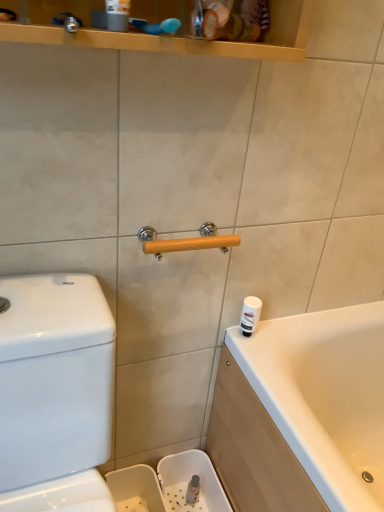
Describe the element at coordinates (54, 384) in the screenshot. The height and width of the screenshot is (512, 384). I see `white glossy water tank at left` at that location.

At what (x,y) coordinates should I click in order to perform the action: click on wooden at center. Please return your answer as a coordinate pair (x, y). The image size is (384, 512). Looking at the image, I should click on (187, 241).

From a real-world perspective, is white plastic container at right physically above white glossy water tank at left?

Yes, from a real-world perspective, white plastic container at right is over white glossy water tank at left

Is white plastic container at right bigger than white glossy water tank at left?

Actually, white plastic container at right might be smaller than white glossy water tank at left.

Considering the relative sizes of white plastic container at right and white glossy water tank at left in the image provided, is white plastic container at right taller than white glossy water tank at left?

Incorrect, the height of white plastic container at right is not larger of that of white glossy water tank at left.

From the picture: Does wooden at center have a greater height compared to white plastic container at right?

No.

Considering the relative positions of wooden at center and white plastic container at right in the image provided, is wooden at center behind white plastic container at right?

No, it is in front of white plastic container at right.

Between wooden at center and white glossy water tank at left, which one has smaller width?

wooden at center.

Considering the sizes of objects wooden at center and white glossy water tank at left in the image provided, who is taller, wooden at center or white glossy water tank at left?

white glossy water tank at left.

The image size is (384, 512). Identify the location of water tank below the wooden at center (from the image's perspective). (54, 384).

Is wooden at center to the left of white glossy water tank at left from the viewer's perspective?

No, wooden at center is not to the left of white glossy water tank at left.

From the image's perspective, does white glossy water tank at left appear lower than wooden at center?

Correct, white glossy water tank at left appears lower than wooden at center in the image.

Can you see white glossy water tank at left touching wooden at center?

No, white glossy water tank at left is not in contact with wooden at center.

This screenshot has height=512, width=384. In the image, there is a wooden at center. In order to click on water tank below it (from a real-world perspective) in this screenshot , I will do pos(54,384).

Considering the relative sizes of white glossy water tank at left and wooden at center in the image provided, is white glossy water tank at left bigger than wooden at center?

Correct, white glossy water tank at left is larger in size than wooden at center.

In the scene shown: Measure the distance between white glossy water tank at left and white plastic container at right.

18.41 inches.

Identify the location of water tank located underneath the white plastic container at right (from a real-world perspective). (54, 384).

Considering the sizes of objects white glossy water tank at left and white plastic container at right in the image provided, who is shorter, white glossy water tank at left or white plastic container at right?

Standing shorter between the two is white plastic container at right.

Consider the image. Which is in front, white plastic container at right or wooden at center?

wooden at center is closer to the camera.

Is white plastic container at right turned away from wooden at center?

No, white plastic container at right is not facing the opposite direction of wooden at center.

This screenshot has height=512, width=384. Find the location of `door handle that appears on the left of white plastic container at right`. door handle that appears on the left of white plastic container at right is located at coordinates (187, 241).

From a real-world perspective, is white plastic container at right positioned above or below wooden at center?

white plastic container at right is situated lower than wooden at center in the real world.

Where is `water tank in front of the white plastic container at right`? The image size is (384, 512). water tank in front of the white plastic container at right is located at coordinates (54, 384).

Identify the location of door handle that is above the white plastic container at right (from a real-world perspective). This screenshot has width=384, height=512. (187, 241).

Consider the image. Based on their spatial positions, is white glossy water tank at left or white plastic container at right closer to wooden at center?

Based on the image, white plastic container at right appears to be nearer to wooden at center.

Considering their positions, is white glossy water tank at left positioned closer to white plastic container at right than wooden at center?

The object closer to white plastic container at right is wooden at center.

Estimate the real-world distances between objects in this image. Which object is further from white glossy water tank at left, white plastic container at right or wooden at center?

white plastic container at right lies further to white glossy water tank at left than the other object.

From the picture: When comparing their distances from white plastic container at right, does wooden at center or white glossy water tank at left seem closer?

wooden at center is closer to white plastic container at right.

From the image, which object appears to be farther from white glossy water tank at left, wooden at center or white plastic container at right?

Based on the image, white plastic container at right appears to be further to white glossy water tank at left.

Looking at the image, which one is located closer to wooden at center, white plastic container at right or white glossy water tank at left?

white plastic container at right is closer to wooden at center.

Locate an element on the screen. door handle positioned between white glossy water tank at left and white plastic container at right from near to far is located at coordinates (187, 241).